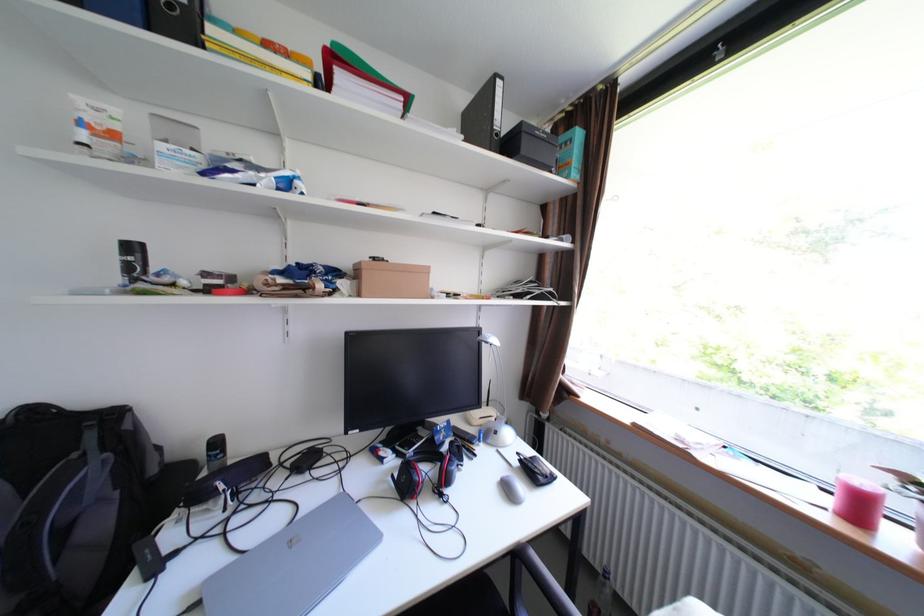
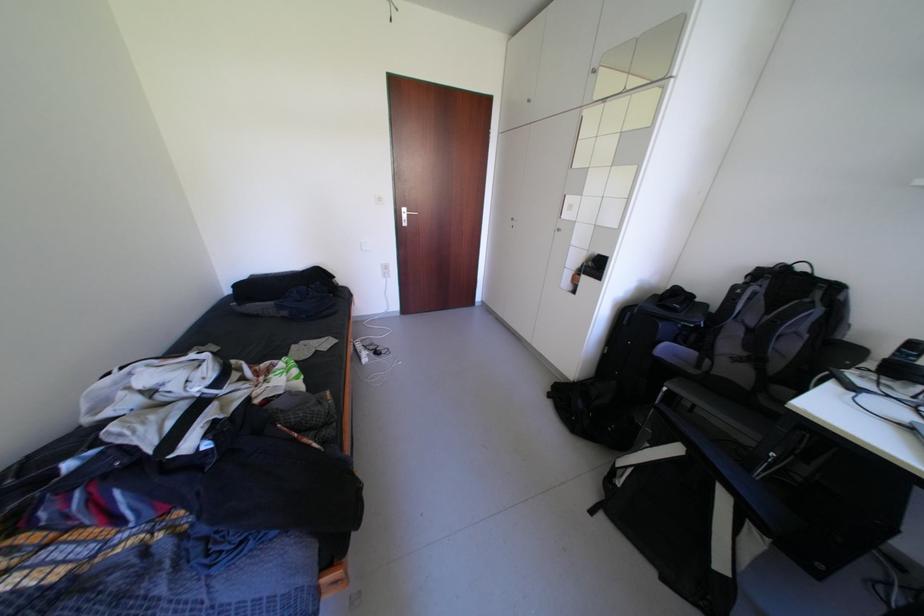
The images are taken continuously from a first-person perspective. In which direction is your viewpoint rotating?

The rotation direction of the camera is left-down.